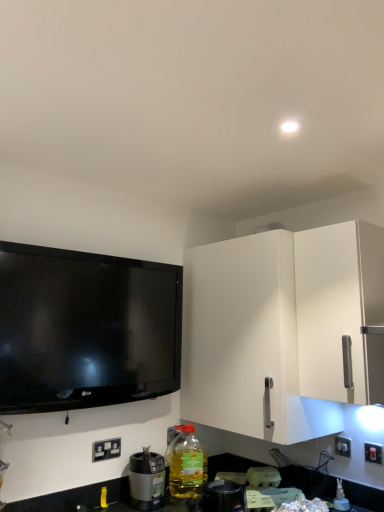
Question: From the image's perspective, relative to translucent plastic bottle at lower center, is metallic silver blender at lower center, the 2th appliance from the left, above or below?

Choices:
 (A) above
 (B) below

Answer: (B)

Question: Based on their sizes in the image, would you say metallic silver blender at lower center, the 2th appliance from the left, is bigger or smaller than translucent plastic bottle at lower center?

Choices:
 (A) small
 (B) big

Answer: (A)

Question: Which of these objects is positioned farthest from the metallic silver blender at lower center, placed as the 1th appliance when sorted from right to left?

Choices:
 (A) white plastic electrical outlet at lower left, acting as the first electric outlet starting from the left
 (B) white matte cabinet at right
 (C) black plastic blender at lower left, which is the 2th appliance from right to left
 (D) white plastic switch at lower right, which is counted as the second electric outlet, starting from the left
 (E) translucent plastic bottle at lower center

Answer: (D)

Question: Which is nearer to the metallic silver blender at lower center, placed as the 1th appliance when sorted from right to left?

Choices:
 (A) translucent plastic bottle at lower center
 (B) white plastic switch at lower right, which is counted as the second electric outlet, starting from the left
 (C) white matte cabinet at right
 (D) white plastic electrical outlet at lower left, acting as the first electric outlet starting from the left
 (E) black plastic blender at lower left, acting as the 1th appliance starting from the left

Answer: (A)